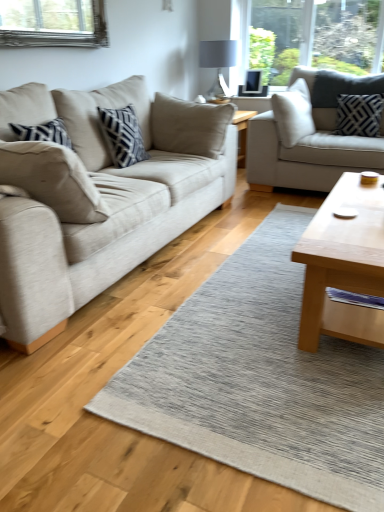
What are the coordinates of `vacant space behind light brown wooden coffee table at center right` in the screenshot? It's located at (256, 236).